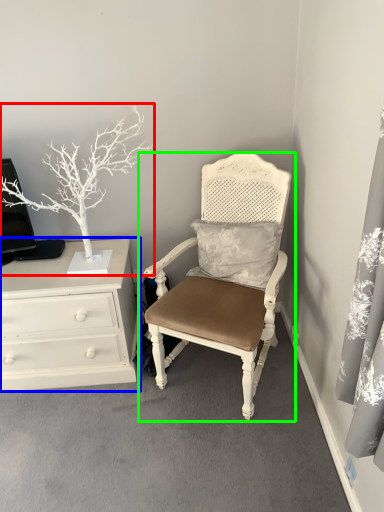
Question: Which object is the farthest from houseplant (highlighted by a red box)? Choose among these: chest of drawers (highlighted by a blue box) or chair (highlighted by a green box).

Choices:
 (A) chest of drawers
 (B) chair

Answer: (B)